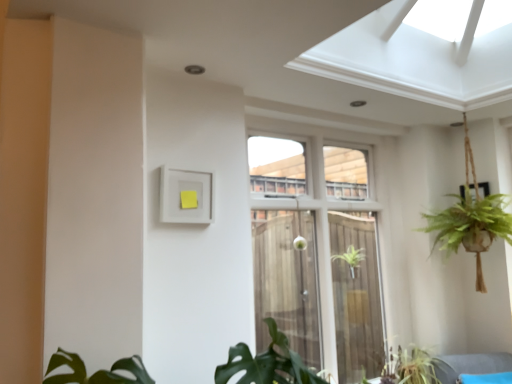
Image resolution: width=512 pixels, height=384 pixels. What do you see at coordinates (317, 250) in the screenshot?
I see `white glass window at center` at bounding box center [317, 250].

What is the approximate height of white glass window at center?

1.77 meters.

In order to face white glass window at center, should I rotate leftwards or rightwards?

To face it directly, rotate right by 10.187 degrees.

At what (x,y) coordinates should I click in order to perform the action: click on white glass window at center. Please return your answer as a coordinate pair (x, y). This screenshot has height=384, width=512. Looking at the image, I should click on (317, 250).

The image size is (512, 384). What are the coordinates of `green leafy plant at lower center` in the screenshot? It's located at (410, 367).

The height and width of the screenshot is (384, 512). What do you see at coordinates (410, 367) in the screenshot?
I see `green leafy plant at lower center` at bounding box center [410, 367].

Where is `white glass window at center`? Image resolution: width=512 pixels, height=384 pixels. white glass window at center is located at coordinates (317, 250).

Considering the relative positions of white glass window at center and green leafy plant at lower center in the image provided, is white glass window at center to the right of green leafy plant at lower center from the viewer's perspective?

No, white glass window at center is not to the right of green leafy plant at lower center.

Who is more distant, white glass window at center or green leafy plant at lower center?

green leafy plant at lower center is more distant.

Does point (354, 301) come behind point (392, 353)?

Yes.

From the image's perspective, relative to green leafy plant at lower center, is white glass window at center above or below?

From the image's perspective, white glass window at center appears above green leafy plant at lower center.

From a real-world perspective, does white glass window at center stand above green leafy plant at lower center?

Yes.

Is white glass window at center thinner than green leafy plant at lower center?

Correct, the width of white glass window at center is less than that of green leafy plant at lower center.

Looking at this image, who is taller, white glass window at center or green leafy plant at lower center?

Standing taller between the two is white glass window at center.

Considering the sizes of objects white glass window at center and green leafy plant at lower center in the image provided, who is smaller, white glass window at center or green leafy plant at lower center?

With smaller size is green leafy plant at lower center.

Is white glass window at center positioned beyond the bounds of green leafy plant at lower center?

Yes, white glass window at center is located beyond the bounds of green leafy plant at lower center.

In the scene shown: Are white glass window at center and green leafy plant at lower center far apart?

No, there isn't a large distance between white glass window at center and green leafy plant at lower center.

Is white glass window at center facing towards green leafy plant at lower center?

Yes, white glass window at center is turned towards green leafy plant at lower center.

How different are the orientations of white glass window at center and green leafy plant at lower center in degrees?

white glass window at center and green leafy plant at lower center are facing 0.773 degrees away from each other.

What are the coordinates of `houseplant on the right of white glass window at center` in the screenshot? It's located at (410, 367).

Visually, is green leafy plant at lower center positioned to the left or to the right of white glass window at center?

Based on their positions, green leafy plant at lower center is located to the right of white glass window at center.

Between green leafy plant at lower center and white glass window at center, which one is positioned in front?

white glass window at center is more forward.

Which is closer to the camera, (429, 365) or (380, 325)?

Positioned in front is point (429, 365).

From the image's perspective, is green leafy plant at lower center beneath white glass window at center?

Indeed, from the image's perspective, green leafy plant at lower center is shown beneath white glass window at center.

From a real-world perspective, which object rests below the other?

green leafy plant at lower center is physically lower.

Is green leafy plant at lower center thinner than white glass window at center?

Incorrect, the width of green leafy plant at lower center is not less than that of white glass window at center.

Who is taller, green leafy plant at lower center or white glass window at center?

white glass window at center.

Can you confirm if green leafy plant at lower center is bigger than white glass window at center?

Incorrect, green leafy plant at lower center is not larger than white glass window at center.

Would you say green leafy plant at lower center is outside white glass window at center?

No.

Are green leafy plant at lower center and white glass window at center far apart?

No, there isn't a large distance between green leafy plant at lower center and white glass window at center.

Is green leafy plant at lower center oriented towards white glass window at center?

No, green leafy plant at lower center is not facing towards white glass window at center.

How different are the orientations of green leafy plant at lower center and white glass window at center in degrees?

There is a 0.773-degree angle between the facing directions of green leafy plant at lower center and white glass window at center.

Locate an element on the screen. The height and width of the screenshot is (384, 512). houseplant below the white glass window at center (from the image's perspective) is located at coordinates tap(410, 367).

You are a GUI agent. You are given a task and a screenshot of the screen. Output one action in this format:
    pyautogui.click(x=<x>, y=<y>)
    Task: Click on the houseplant behind the white glass window at center
    This screenshot has height=384, width=512.
    Given the screenshot: What is the action you would take?
    pyautogui.click(x=410, y=367)

Find the location of `window lying in front of the green leafy plant at lower center`. window lying in front of the green leafy plant at lower center is located at coordinates (317, 250).